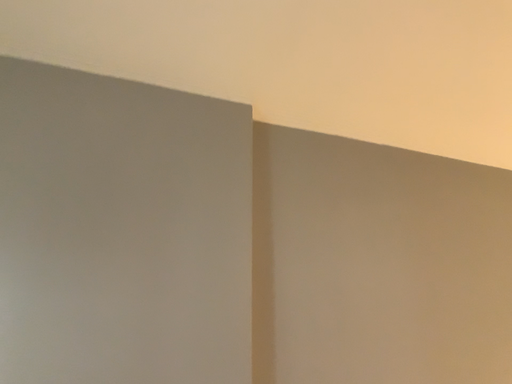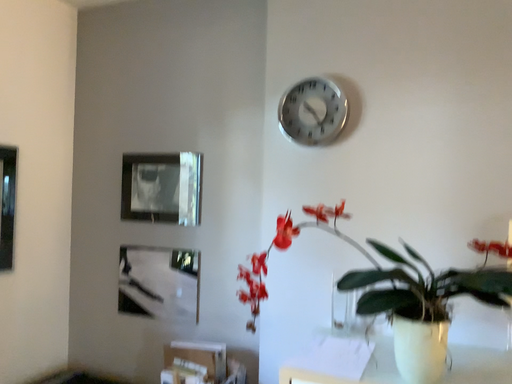
Question: How did the camera likely rotate when shooting the video?

Choices:
 (A) rotated left
 (B) rotated right

Answer: (A)